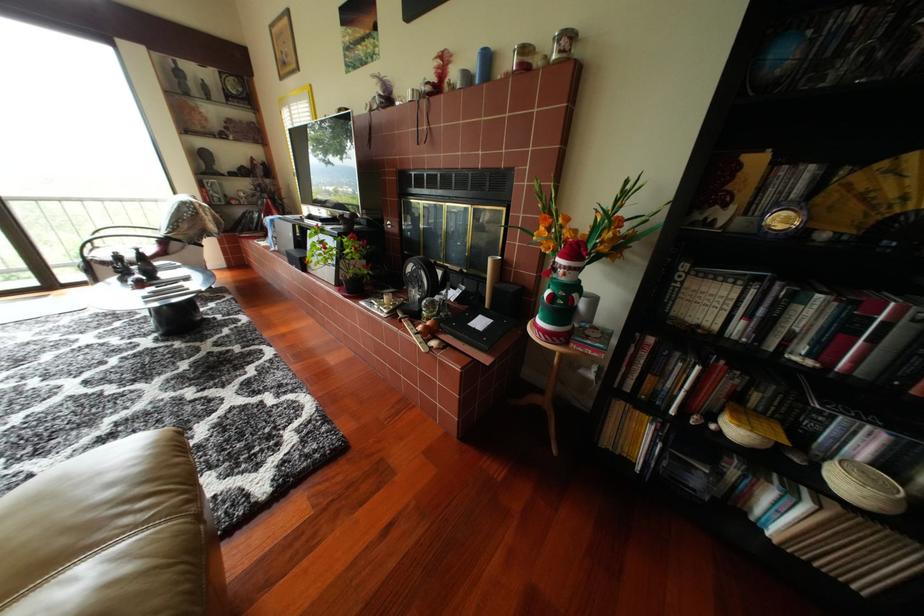
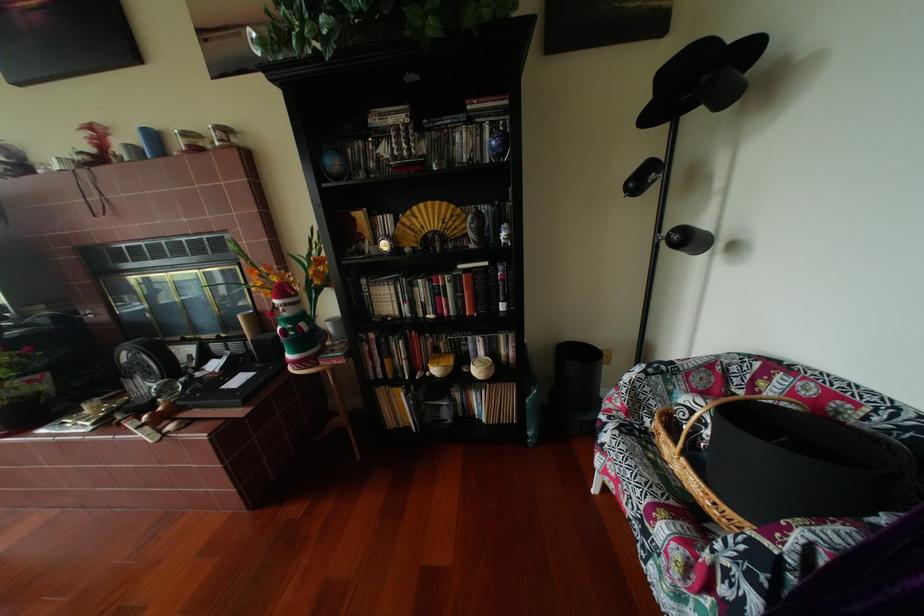
In the second image, find the point that corresponds to (698,268) in the first image.

(377, 283)